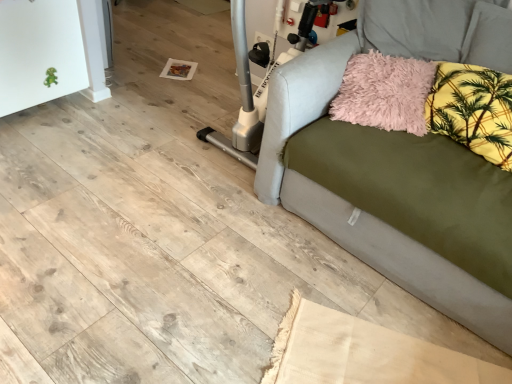
Question: Is beige fabric rug at lower center a part of olive green fabric couch at right?

Choices:
 (A) yes
 (B) no

Answer: (B)

Question: Considering the relative positions of olive green fabric couch at right and beige fabric rug at lower center in the image provided, is olive green fabric couch at right to the left of beige fabric rug at lower center from the viewer's perspective?

Choices:
 (A) yes
 (B) no

Answer: (B)

Question: Does olive green fabric couch at right have a greater height compared to beige fabric rug at lower center?

Choices:
 (A) no
 (B) yes

Answer: (B)

Question: Does olive green fabric couch at right have a greater width compared to beige fabric rug at lower center?

Choices:
 (A) no
 (B) yes

Answer: (B)

Question: From a real-world perspective, is olive green fabric couch at right located higher than beige fabric rug at lower center?

Choices:
 (A) yes
 (B) no

Answer: (A)

Question: From their relative heights in the image, would you say yellow floral fabric pillow at upper right, acting as the 1th pillow starting from the right, is taller or shorter than fluffy pink pillow at upper right, placed as the second pillow when sorted from right to left?

Choices:
 (A) tall
 (B) short

Answer: (A)

Question: Which is correct: yellow floral fabric pillow at upper right, the 2th pillow from the left, is inside fluffy pink pillow at upper right, which ranks as the first pillow in left-to-right order, or outside of it?

Choices:
 (A) inside
 (B) outside

Answer: (B)

Question: In terms of width, does yellow floral fabric pillow at upper right, the 2th pillow from the left, look wider or thinner when compared to fluffy pink pillow at upper right, which ranks as the first pillow in left-to-right order?

Choices:
 (A) wide
 (B) thin

Answer: (B)

Question: From a real-world perspective, is yellow floral fabric pillow at upper right, acting as the 1th pillow starting from the right, above or below fluffy pink pillow at upper right, placed as the second pillow when sorted from right to left?

Choices:
 (A) above
 (B) below

Answer: (A)

Question: From a real-world perspective, is fluffy pink pillow at upper right, placed as the second pillow when sorted from right to left, physically located above or below olive green fabric couch at right?

Choices:
 (A) above
 (B) below

Answer: (A)

Question: Is fluffy pink pillow at upper right, which ranks as the first pillow in left-to-right order, situated inside olive green fabric couch at right or outside?

Choices:
 (A) inside
 (B) outside

Answer: (A)

Question: From the image's perspective, relative to olive green fabric couch at right, is fluffy pink pillow at upper right, which ranks as the first pillow in left-to-right order, above or below?

Choices:
 (A) above
 (B) below

Answer: (A)

Question: Is fluffy pink pillow at upper right, placed as the second pillow when sorted from right to left, bigger or smaller than olive green fabric couch at right?

Choices:
 (A) big
 (B) small

Answer: (B)

Question: In the image, is fluffy pink pillow at upper right, placed as the second pillow when sorted from right to left, on the left side or the right side of yellow floral fabric pillow at upper right, acting as the 1th pillow starting from the right?

Choices:
 (A) left
 (B) right

Answer: (A)

Question: From the image's perspective, relative to yellow floral fabric pillow at upper right, the 2th pillow from the left, is fluffy pink pillow at upper right, placed as the second pillow when sorted from right to left, above or below?

Choices:
 (A) below
 (B) above

Answer: (B)